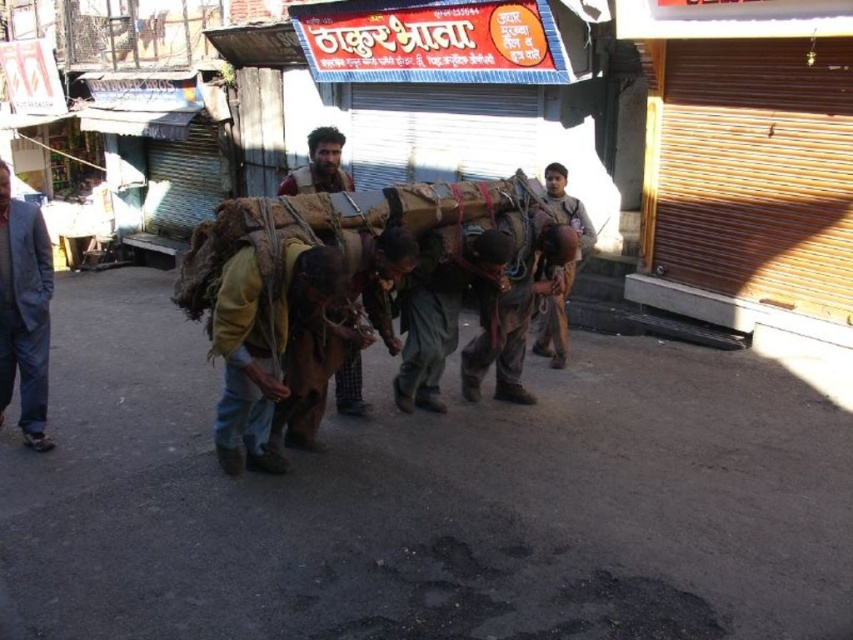
You are a fashion designer observing jackets in a market scene. You notice a brown leather jacket at center and a light blue fabric jacket at left. Which jacket would you recommend to a client who prefers a more oversized style?

The brown leather jacket at center is larger in size than the light blue fabric jacket at left, so it would be the better recommendation for an oversized style.

You are a photographer standing at the center of the street. You want to take a photo of the brown leather jacket at center. Where should you point your camera to capture it in the frame?

You should point your camera to the coordinates at point [263,342] to capture the brown leather jacket at center in the frame.